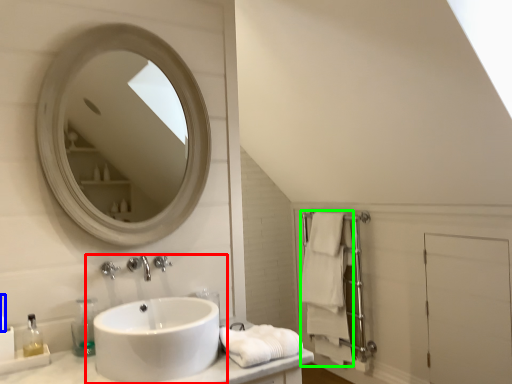
Question: Which object is the closest to the sink (highlighted by a red box)? Choose among these: toiletry (highlighted by a blue box) or bath towel (highlighted by a green box).

Choices:
 (A) toiletry
 (B) bath towel

Answer: (A)